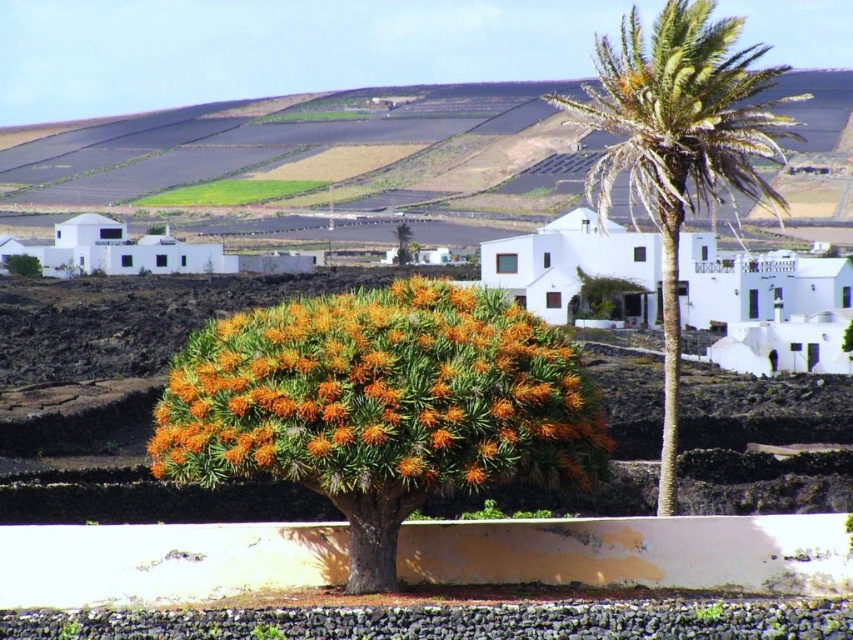
Question: Which object is positioned closest to the orange spiky bush at center?

Choices:
 (A) green leafy palm at upper right
 (B) orange fuzzy bush at center

Answer: (A)

Question: Can you confirm if orange fuzzy bush at center is smaller than orange spiky bush at center?

Choices:
 (A) no
 (B) yes

Answer: (A)

Question: Does orange fuzzy bush at center appear under green leafy palm at upper right?

Choices:
 (A) yes
 (B) no

Answer: (A)

Question: Is green leafy palm at upper right positioned behind orange spiky bush at center?

Choices:
 (A) yes
 (B) no

Answer: (B)

Question: Which object is positioned farthest from the orange fuzzy bush at center?

Choices:
 (A) orange spiky bush at center
 (B) green leafy palm at upper right

Answer: (A)

Question: Which is nearer to the green leafy palm at upper right?

Choices:
 (A) orange fuzzy bush at center
 (B) orange spiky bush at center

Answer: (A)